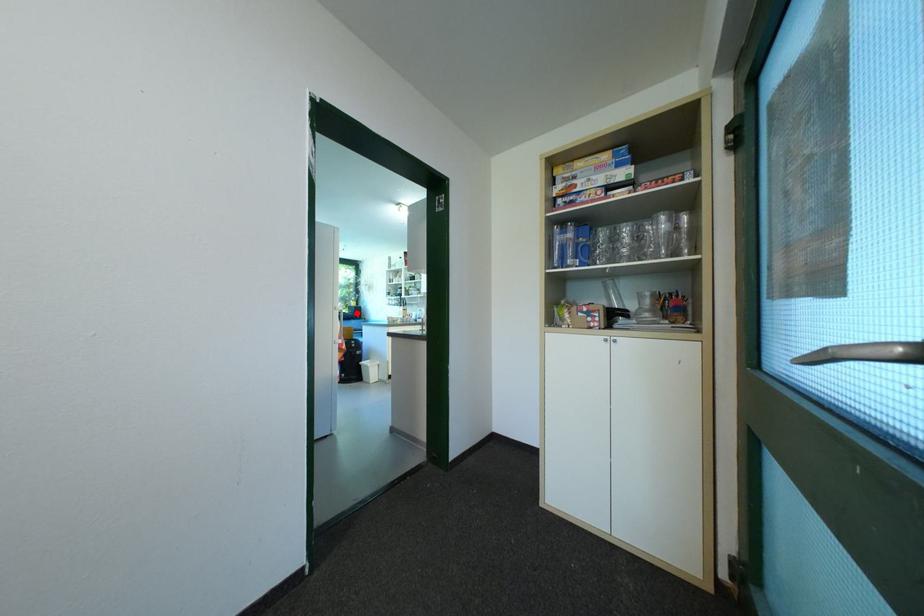
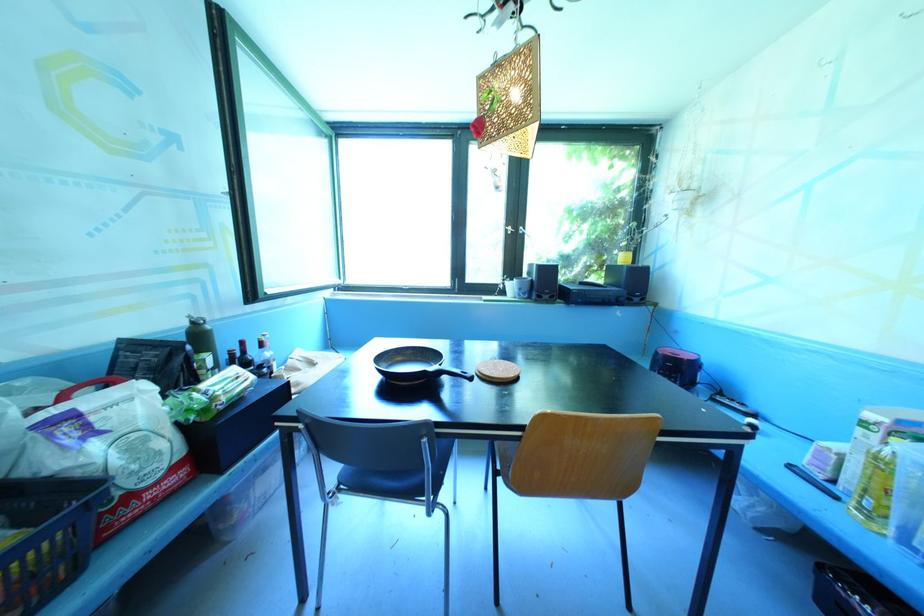
Question: I am providing you with two images of the same scene from different viewpoints. A red point is marked on the first image. At the location where the point appears in image 1, is it still visible in image 2?

Choices:
 (A) Yes
 (B) No

Answer: (A)